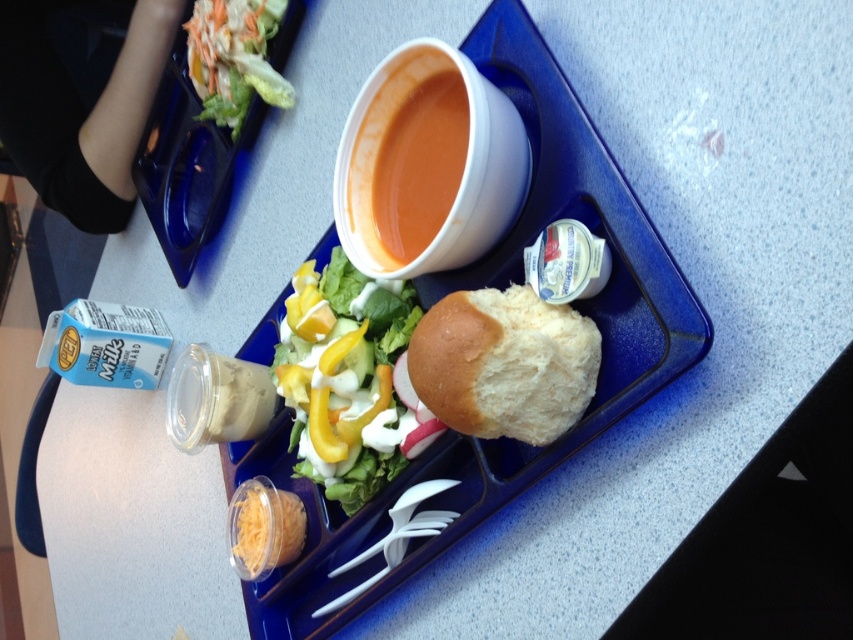
Question: Can you confirm if orange matte soup at center is thinner than fresh green salad at upper left?

Choices:
 (A) no
 (B) yes

Answer: (B)

Question: Can you confirm if fresh green salad at center is positioned above orange matte soup at center?

Choices:
 (A) yes
 (B) no

Answer: (B)

Question: Which object is positioned farthest from the fresh green salad at center?

Choices:
 (A) fresh green salad at upper left
 (B) white fluffy bun at center
 (C) orange matte soup at center

Answer: (A)

Question: Can you confirm if fresh green salad at center is thinner than white fluffy bun at center?

Choices:
 (A) yes
 (B) no

Answer: (B)

Question: Based on their relative distances, which object is nearer to the fresh green salad at center?

Choices:
 (A) orange matte soup at center
 (B) fresh green salad at upper left

Answer: (A)

Question: Estimate the real-world distances between objects in this image. Which object is farther from the orange matte soup at center?

Choices:
 (A) white fluffy bun at center
 (B) fresh green salad at center
 (C) fresh green salad at upper left

Answer: (C)